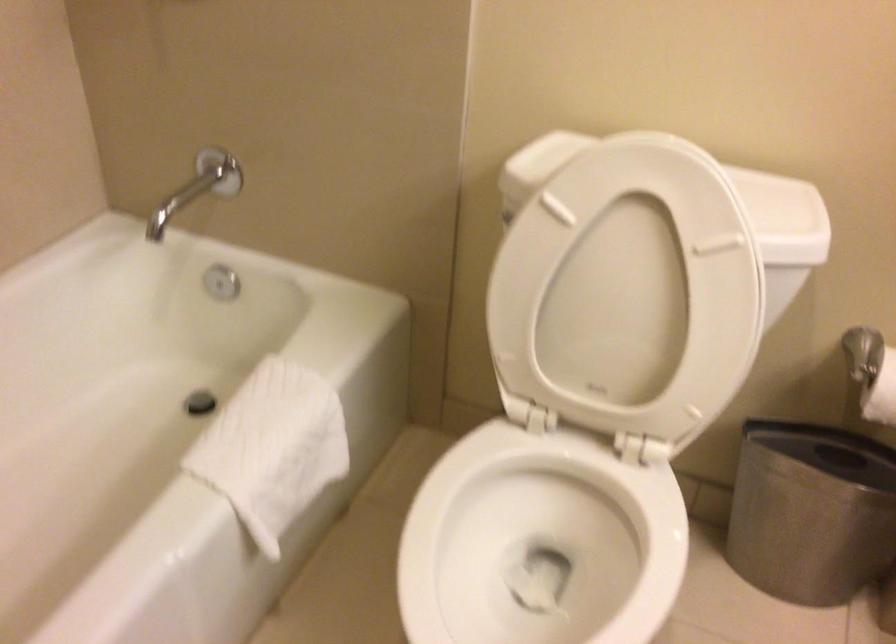
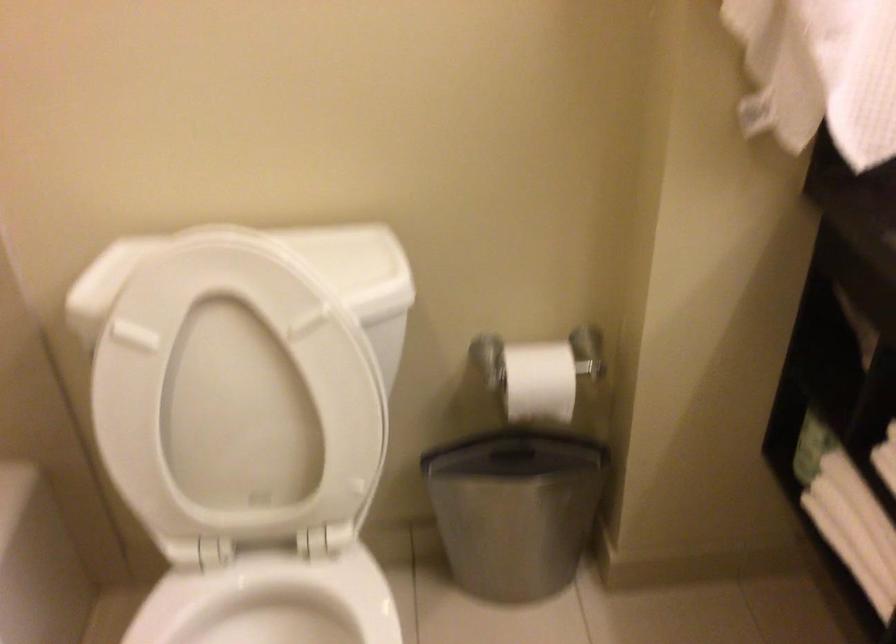
Question: The images are taken continuously from a first-person perspective. In which direction are you moving?

Choices:
 (A) Left
 (B) Right
 (C) Forward
 (D) Backward

Answer: (B)